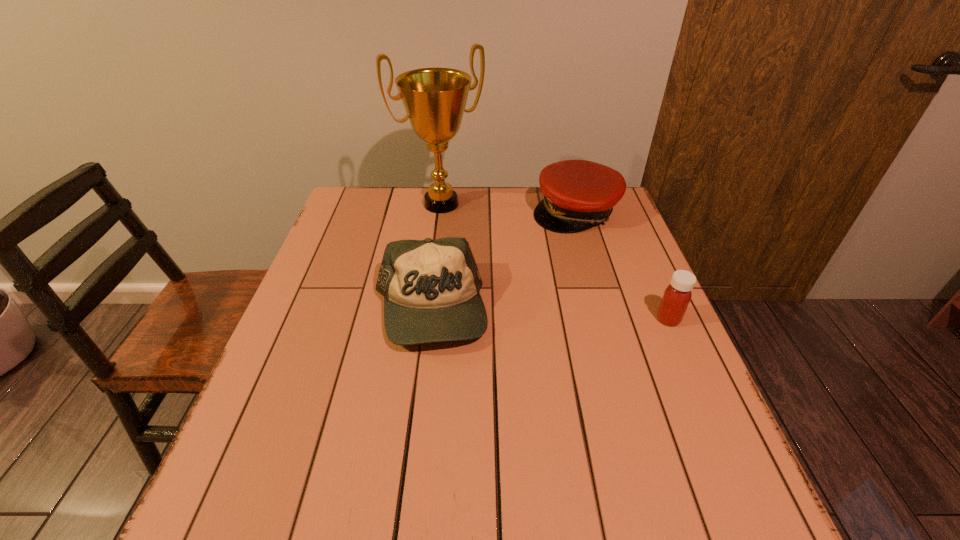
I want to click on vacant region located on the front view with handles of the award, so click(485, 262).

The width and height of the screenshot is (960, 540). I want to click on vacant area located 0.250m on the front view with handles of the award, so 489,269.

Image resolution: width=960 pixels, height=540 pixels. What are the coordinates of `cap present at the far edge` in the screenshot? It's located at (578, 194).

Where is `award that is at the far edge`? This screenshot has height=540, width=960. award that is at the far edge is located at coordinates (434, 99).

Identify the location of medicine that is at the right edge. (676, 298).

The width and height of the screenshot is (960, 540). I want to click on cap positioned at the right edge, so click(x=578, y=194).

Where is `object located in the far right corner section of the desktop`? object located in the far right corner section of the desktop is located at coordinates (578, 194).

This screenshot has width=960, height=540. In the image, there is a desktop. What are the coordinates of `vacant space at the far edge` in the screenshot? It's located at (458, 190).

The image size is (960, 540). In the image, there is a desktop. In order to click on free space at the near edge in this screenshot , I will do `click(402, 455)`.

The image size is (960, 540). What are the coordinates of `free space at the left edge` in the screenshot? It's located at (337, 389).